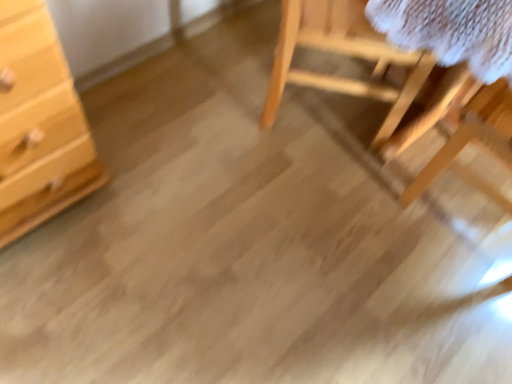
The height and width of the screenshot is (384, 512). Find the location of `free space to the left of natural wood chair at upper right`. free space to the left of natural wood chair at upper right is located at coordinates (215, 97).